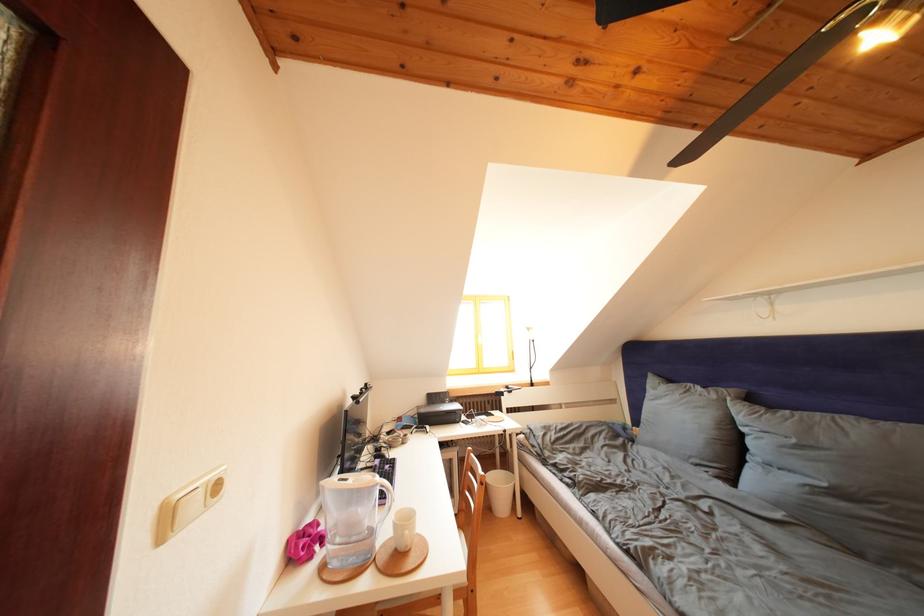
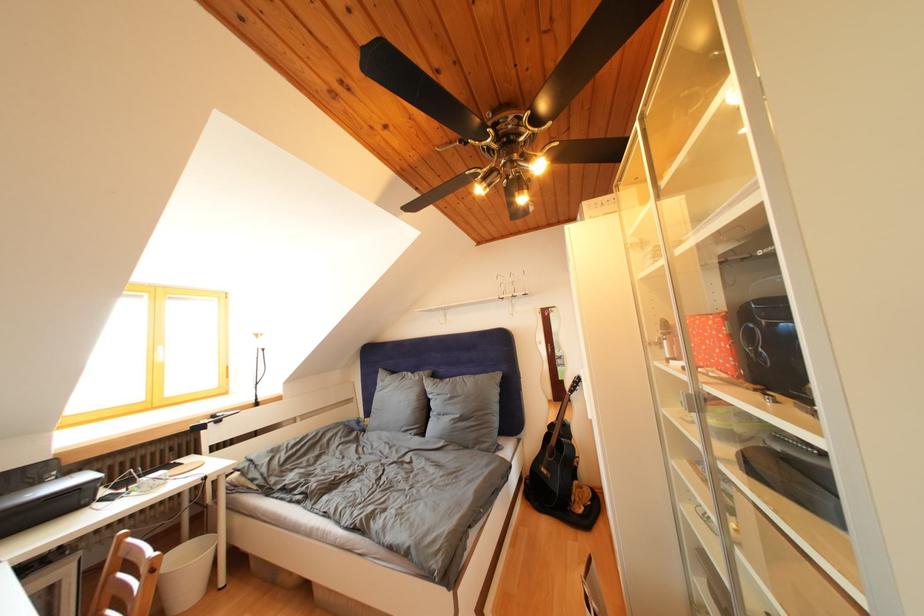
Question: The camera is either moving clockwise (left) or counter-clockwise (right) around the object. The first image is from the beginning of the video and the second image is from the end. Is the camera moving left or right when shooting the video?

Choices:
 (A) Left
 (B) Right

Answer: (A)